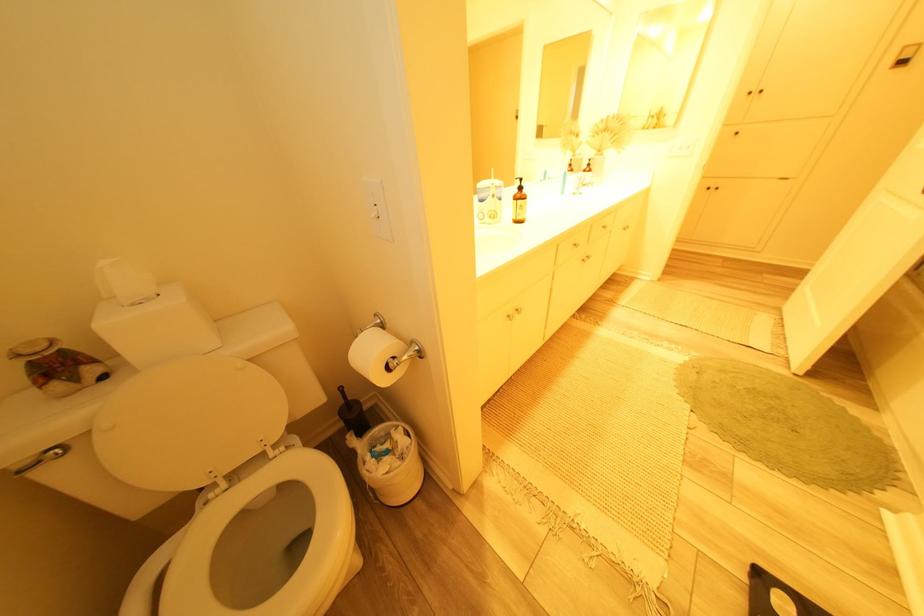
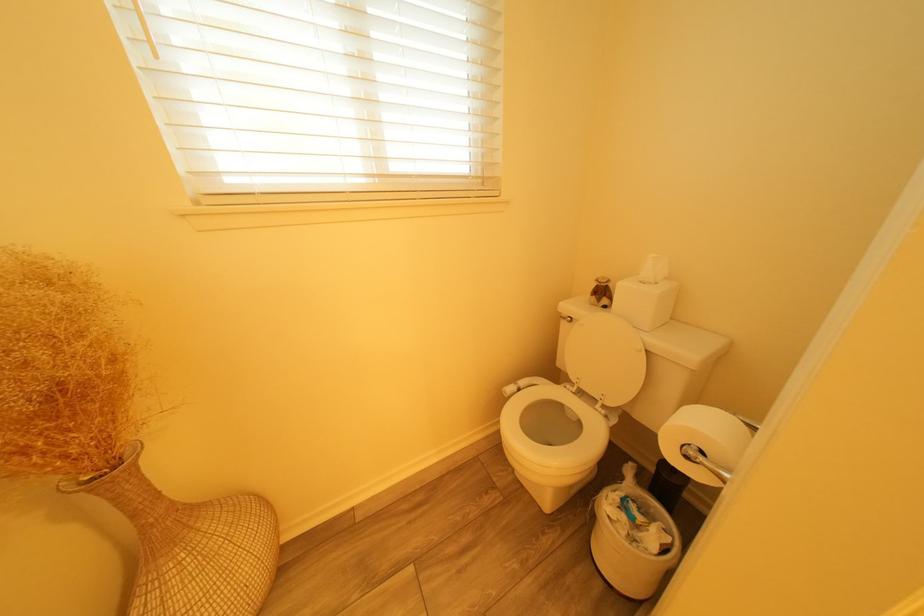
Where in the second image is the point corresponding to (x=405, y=360) from the first image?

(712, 454)